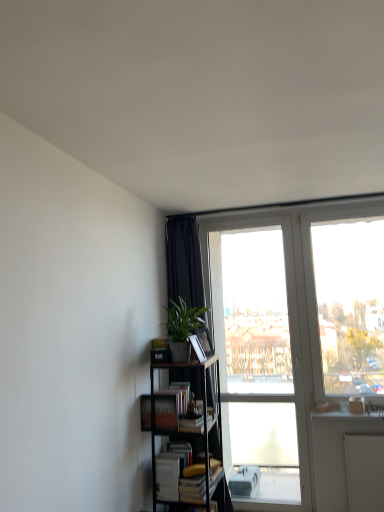
Question: In the image, is transparent glass door at upper right positioned in front of or behind black metal bookcase at lower left?

Choices:
 (A) behind
 (B) front

Answer: (A)

Question: Is transparent glass door at upper right taller or shorter than black metal bookcase at lower left?

Choices:
 (A) tall
 (B) short

Answer: (A)

Question: Estimate the real-world distances between objects in this image. Which object is farther from the hardcover book at center, placed as the 1th paperback book when sorted from bottom to top?

Choices:
 (A) matte black paperback book at center, the 2th paperback book from the bottom
 (B) transparent glass door at upper right
 (C) black metal bookcase at lower left
 (D) green matte plant at center-left
 (E) matte black bookshelf at lower left, the 2th book when ordered from bottom to top

Answer: (B)

Question: Based on their relative distances, which object is farther from the transparent glass door at upper right?

Choices:
 (A) matte black paperback book at center, the 2th paperback book from the bottom
 (B) matte black bookshelf at lower left, acting as the first book starting from the top
 (C) white matte book at lower center, the first book when ordered from bottom to top
 (D) hardcover book at center, the 2th paperback book from the top
 (E) black metal bookcase at lower left

Answer: (D)